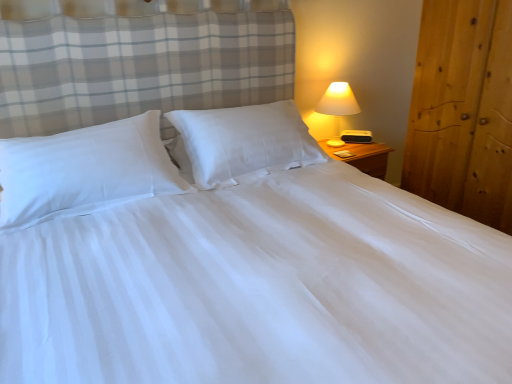
Question: Should I look upward or downward to see white smooth pillow at left, acting as the second pillow starting from the right?

Choices:
 (A) up
 (B) down

Answer: (A)

Question: Is matte white lamp at right not inside white smooth pillow at left, acting as the second pillow starting from the right?

Choices:
 (A) no
 (B) yes

Answer: (B)

Question: Can you confirm if matte white lamp at right is bigger than white smooth pillow at left, acting as the second pillow starting from the right?

Choices:
 (A) no
 (B) yes

Answer: (A)

Question: Would you say white smooth pillow at left, which appears as the first pillow when viewed from the left, is part of matte white lamp at right's contents?

Choices:
 (A) no
 (B) yes

Answer: (A)

Question: Is matte white lamp at right behind white smooth pillow at left, acting as the second pillow starting from the right?

Choices:
 (A) yes
 (B) no

Answer: (A)

Question: Is matte white lamp at right aimed at white smooth pillow at left, acting as the second pillow starting from the right?

Choices:
 (A) yes
 (B) no

Answer: (B)

Question: Does matte white lamp at right have a greater height compared to white smooth pillow at left, acting as the second pillow starting from the right?

Choices:
 (A) no
 (B) yes

Answer: (B)

Question: From the image's perspective, is wooden wardrobe at right located above white smooth pillow at left, acting as the second pillow starting from the right?

Choices:
 (A) yes
 (B) no

Answer: (A)

Question: Considering the relative positions of wooden wardrobe at right and white smooth pillow at left, which appears as the first pillow when viewed from the left, in the image provided, is wooden wardrobe at right to the right of white smooth pillow at left, which appears as the first pillow when viewed from the left, from the viewer's perspective?

Choices:
 (A) yes
 (B) no

Answer: (A)

Question: Does wooden wardrobe at right have a lesser height compared to white smooth pillow at left, which appears as the first pillow when viewed from the left?

Choices:
 (A) no
 (B) yes

Answer: (A)

Question: Considering the relative sizes of wooden wardrobe at right and white smooth pillow at left, which appears as the first pillow when viewed from the left, in the image provided, is wooden wardrobe at right thinner than white smooth pillow at left, which appears as the first pillow when viewed from the left,?

Choices:
 (A) yes
 (B) no

Answer: (B)

Question: Considering the relative positions of wooden wardrobe at right and white smooth pillow at left, acting as the second pillow starting from the right, in the image provided, is wooden wardrobe at right to the left of white smooth pillow at left, acting as the second pillow starting from the right, from the viewer's perspective?

Choices:
 (A) no
 (B) yes

Answer: (A)

Question: From a real-world perspective, is wooden wardrobe at right located beneath white smooth pillow at left, which appears as the first pillow when viewed from the left?

Choices:
 (A) yes
 (B) no

Answer: (A)

Question: Are matte white lamp at right and white smooth pillow at center, positioned as the 1th pillow in right-to-left order, beside each other?

Choices:
 (A) yes
 (B) no

Answer: (B)